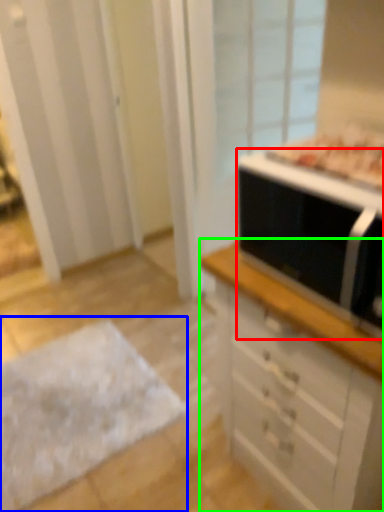
Question: Which object is the closest to the microwave oven (highlighted by a red box)? Choose among these: flat (highlighted by a blue box) or chest of drawers (highlighted by a green box).

Choices:
 (A) flat
 (B) chest of drawers

Answer: (B)